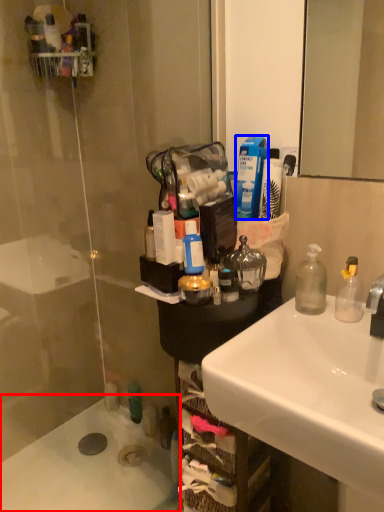
Question: Which point is further to the camera, bath (highlighted by a red box) or mouthwash (highlighted by a blue box)?

Choices:
 (A) bath
 (B) mouthwash

Answer: (A)